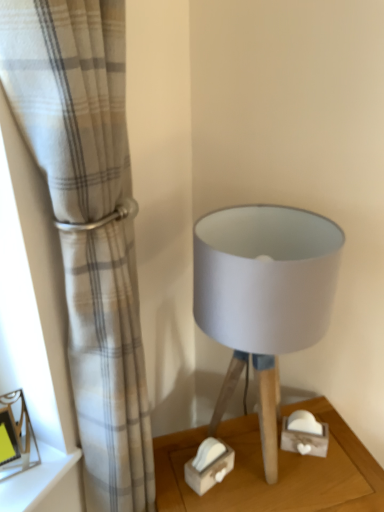
Find the location of a particular element. Image resolution: width=384 pixels, height=512 pixels. free point above wooden table at lower right (from a real-world perspective) is located at coordinates (278, 470).